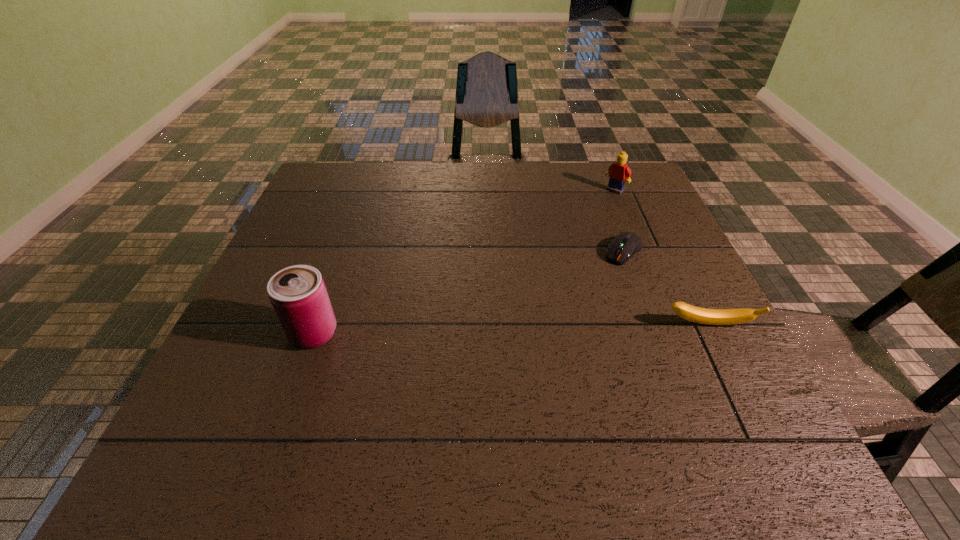
This screenshot has height=540, width=960. What are the coordinates of `the leftmost object` in the screenshot? It's located at (298, 294).

This screenshot has height=540, width=960. I want to click on can, so click(x=298, y=294).

This screenshot has height=540, width=960. Identify the location of banana. (688, 312).

Find the location of a particular element. This screenshot has height=540, width=960. the shortest object is located at coordinates (625, 245).

Locate an element on the screen. The image size is (960, 540). the second farthest object is located at coordinates (625, 245).

Locate an element on the screen. the second tallest object is located at coordinates (618, 171).

This screenshot has width=960, height=540. I want to click on Lego, so click(618, 171).

Find the location of `free space located 0.100m on the back of the can`. free space located 0.100m on the back of the can is located at coordinates (331, 284).

Where is `vacant space situated at the stem of the third tallest object`? vacant space situated at the stem of the third tallest object is located at coordinates (746, 399).

In order to click on free space located on the button of the computer equipment in this screenshot , I will do `click(605, 274)`.